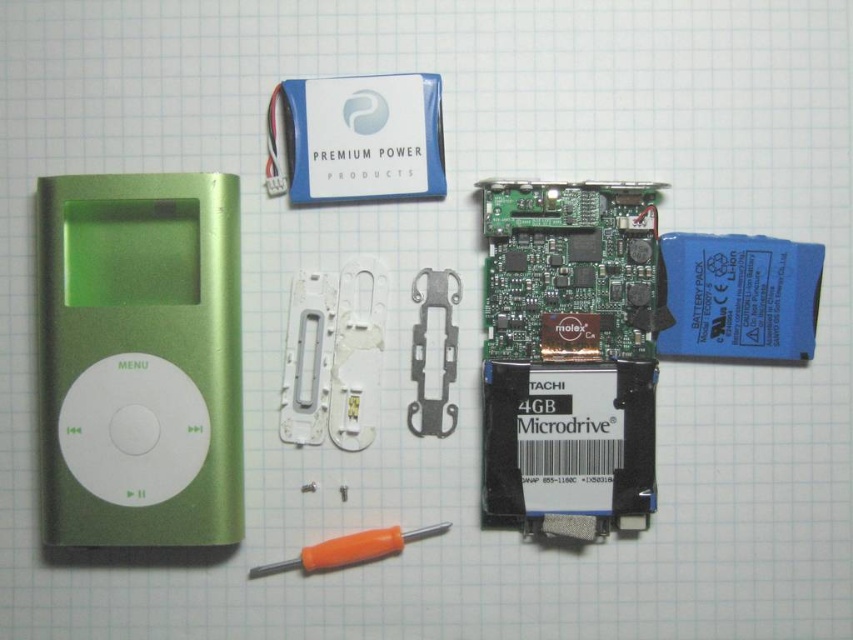
Question: Among these points, which one is farthest from the camera?

Choices:
 (A) (70, 212)
 (B) (273, 573)

Answer: (B)

Question: Can you confirm if green metallic ipod at left is positioned to the left of orange plastic screwdriver at center?

Choices:
 (A) yes
 (B) no

Answer: (A)

Question: Is green metallic ipod at left further to the viewer compared to orange plastic screwdriver at center?

Choices:
 (A) yes
 (B) no

Answer: (B)

Question: Is green metallic ipod at left positioned in front of orange plastic screwdriver at center?

Choices:
 (A) yes
 (B) no

Answer: (A)